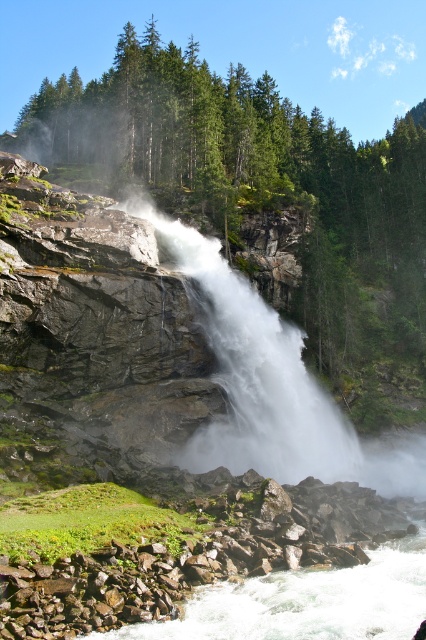
You are standing at the base of the waterfall and notice a specific point marked at coordinates point (256, 179). Based on the scene description, what object is this point located on?

The point (256, 179) is located on the green matte tree at center.

You are an environmental scientist assessing the scene. You need to determine which object occupies more space in the image between the green matte tree at center and the white frothy water at lower center. Based on the description, which one is larger?

The green matte tree at center has a larger size compared to the white frothy water at lower center, so the green matte tree at center occupies more space in the image.